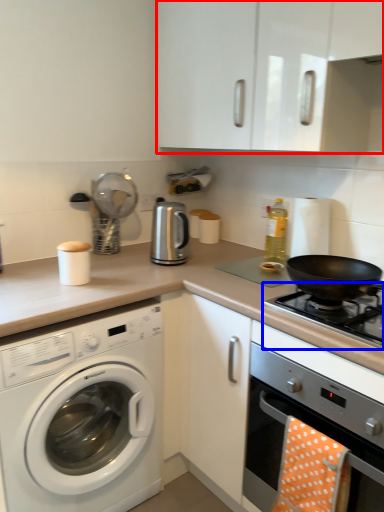
Question: Which point is further to the camera, cabinetry (highlighted by a red box) or gas stove (highlighted by a blue box)?

Choices:
 (A) cabinetry
 (B) gas stove

Answer: (B)